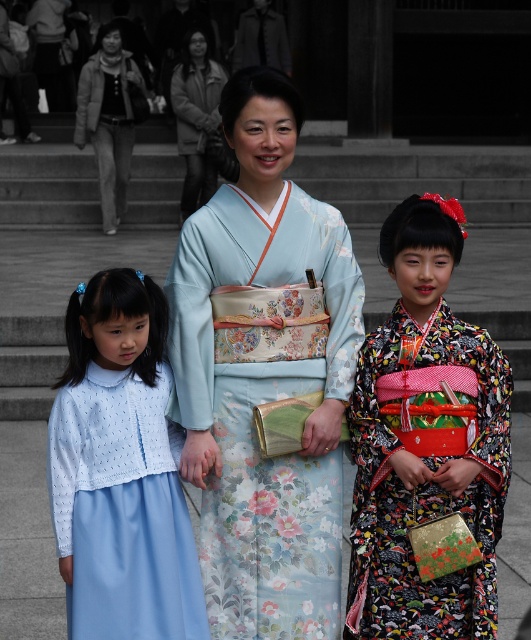
You are a photographer positioned in front of the family. You need to capture a photo where the light blue floral kimono at center and the floral silk kimono at center are both visible. Which kimono should you focus on first to ensure both are in frame?

The light blue floral kimono at center is to the left of the floral silk kimono at center, so focus on the light blue floral kimono at center first to ensure both are in frame.